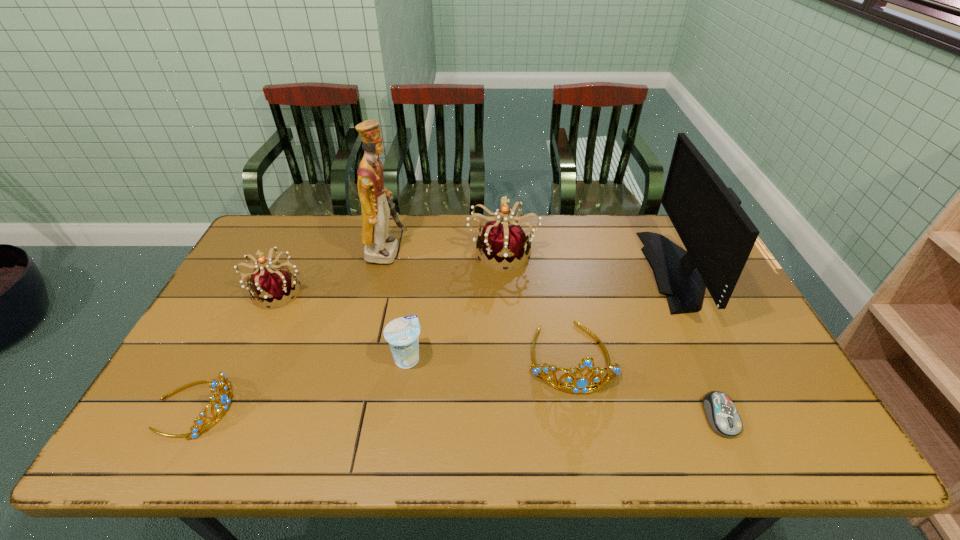
The image size is (960, 540). I want to click on vacant position located 0.140m on the front-facing side of the second shortest tiara, so click(590, 451).

Where is `vacant area situated 0.200m on the right of the fifth object from right to left`? vacant area situated 0.200m on the right of the fifth object from right to left is located at coordinates (499, 357).

Where is `free spot located 0.300m on the front-facing side of the left gold tiara`? Image resolution: width=960 pixels, height=540 pixels. free spot located 0.300m on the front-facing side of the left gold tiara is located at coordinates (354, 407).

Locate an element on the screen. nutcracker that is at the far edge is located at coordinates (380, 248).

Locate an element on the screen. monitor present at the far edge is located at coordinates (718, 235).

Identify the location of tiara present at the far edge. Image resolution: width=960 pixels, height=540 pixels. (503, 243).

You are a GUI agent. You are given a task and a screenshot of the screen. Output one action in this format:
    pyautogui.click(x=<x>, y=<y>)
    Task: Click on the tiara situated at the near edge
    
    Given the screenshot: What is the action you would take?
    pyautogui.click(x=225, y=398)

This screenshot has width=960, height=540. I want to click on computer mouse present at the near edge, so click(x=722, y=415).

This screenshot has height=540, width=960. What are the coordinates of `object that is positioned at the right edge` in the screenshot? It's located at (718, 235).

What are the coordinates of `object positioned at the near left corner` in the screenshot? It's located at (225, 398).